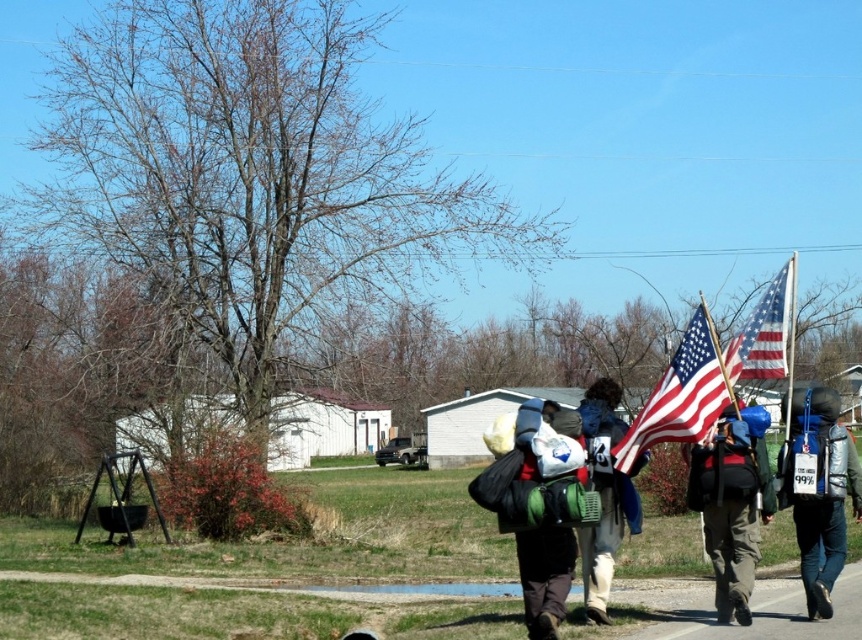
Question: Can you confirm if matte black backpack at center is positioned above blue fabric backpack at center?

Choices:
 (A) yes
 (B) no

Answer: (A)

Question: Among these points, which one is farthest from the camera?

Choices:
 (A) (796, 394)
 (B) (748, 518)
 (C) (528, 611)

Answer: (A)

Question: Based on their relative distances, which object is farther from the blue fabric backpack at center?

Choices:
 (A) matte black backpack at center
 (B) matte green backpack at center
 (C) american flag at right

Answer: (C)

Question: Is silver metallic backpack at right positioned at the back of american flag at center?

Choices:
 (A) yes
 (B) no

Answer: (A)

Question: Observing the image, what is the correct spatial positioning of silver metallic backpack at right in reference to american flag at right?

Choices:
 (A) above
 (B) below

Answer: (B)

Question: Which object is closer to the camera taking this photo?

Choices:
 (A) matte green backpack at center
 (B) american flag at right
 (C) matte black backpack at center

Answer: (A)